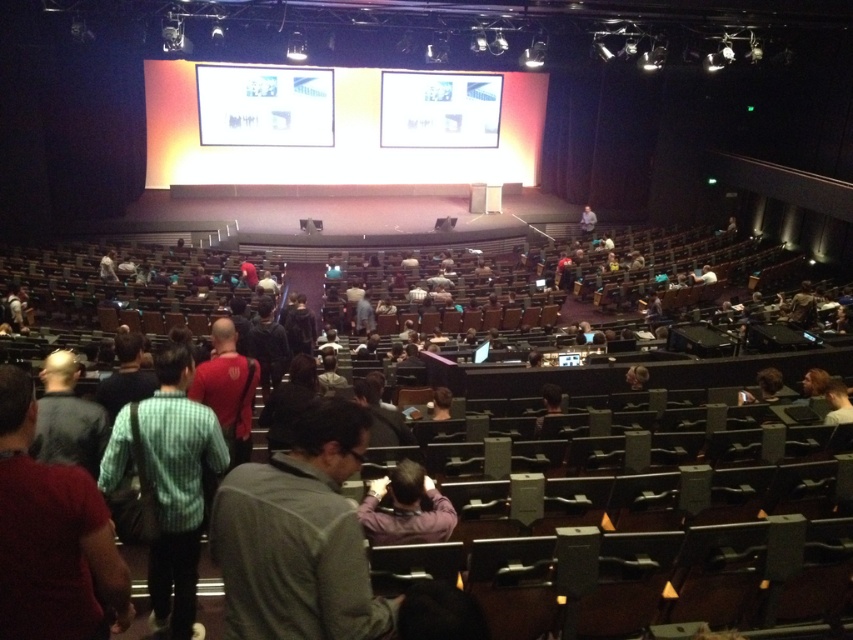
You are sitting in the auditorium and want to see the stage clearly. There is a person wearing a green checkered shirt at center and another wearing a green shirt at lower left in front of you. Which person might be blocking your view more due to their height?

The green checkered shirt at center is much taller than the green shirt at lower left, so it might be blocking your view more.

You are sitting in the auditorium and want to know which of the two points, point [164,596] or point [410,483], is closer to you. Can you determine this based on their positions?

Point [164,596] is closer to you than point [410,483].

You are sitting in the auditorium and want to see the stage clearly. There are two people in green shirts blocking your view. Which of the two, the green checkered shirt at center or the green shirt at lower left, is closer to the stage and thus blocking your view more?

The green checkered shirt at center is in front of the green shirt at lower left, meaning it is closer to the stage and blocking your view more.